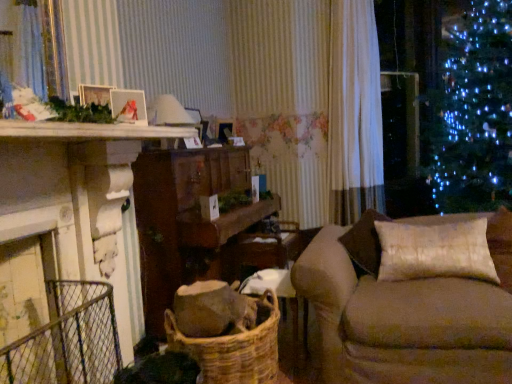
Question: Is satin beige pillow at right far from wooden table at center?

Choices:
 (A) no
 (B) yes

Answer: (B)

Question: Considering the relative positions of satin beige pillow at right and wooden table at center in the image provided, is satin beige pillow at right behind wooden table at center?

Choices:
 (A) no
 (B) yes

Answer: (A)

Question: Could wooden table at center be considered to be inside satin beige pillow at right?

Choices:
 (A) yes
 (B) no

Answer: (B)

Question: Is satin beige pillow at right positioned before wooden table at center?

Choices:
 (A) yes
 (B) no

Answer: (A)

Question: Is satin beige pillow at right placed right next to wooden table at center?

Choices:
 (A) yes
 (B) no

Answer: (B)

Question: Can you confirm if satin beige pillow at right is shorter than wooden table at center?

Choices:
 (A) yes
 (B) no

Answer: (A)

Question: Can you confirm if metallic silver frame at upper left is smaller than woven brown basket at lower center?

Choices:
 (A) no
 (B) yes

Answer: (B)

Question: Considering the relative sizes of metallic silver frame at upper left and woven brown basket at lower center in the image provided, is metallic silver frame at upper left shorter than woven brown basket at lower center?

Choices:
 (A) no
 (B) yes

Answer: (B)

Question: Is metallic silver frame at upper left further to the viewer compared to woven brown basket at lower center?

Choices:
 (A) no
 (B) yes

Answer: (A)

Question: Is metallic silver frame at upper left far away from woven brown basket at lower center?

Choices:
 (A) no
 (B) yes

Answer: (A)

Question: Considering the relative sizes of metallic silver frame at upper left and woven brown basket at lower center in the image provided, is metallic silver frame at upper left bigger than woven brown basket at lower center?

Choices:
 (A) yes
 (B) no

Answer: (B)

Question: From the image's perspective, is metallic silver frame at upper left under woven brown basket at lower center?

Choices:
 (A) yes
 (B) no

Answer: (B)

Question: Is white sheer curtain at center in front of metallic silver frame at upper left?

Choices:
 (A) no
 (B) yes

Answer: (A)